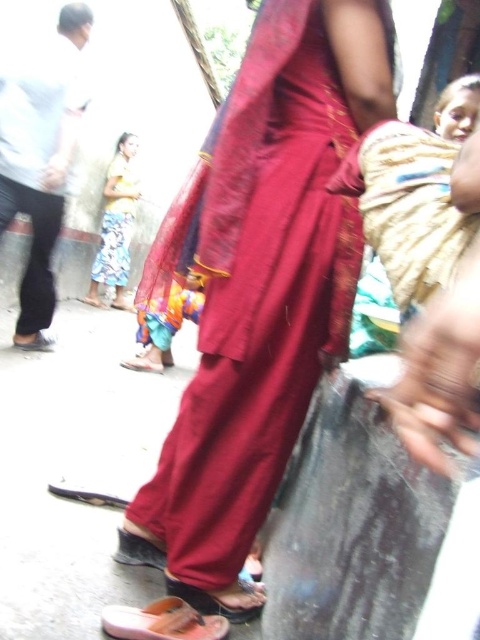
Is point (240, 140) farther from viewer compared to point (196, 588)?

That is False.

Between point (162, 253) and point (194, 588), which one is positioned behind?

The point (162, 253) is behind.

Is point (247, 58) positioned before point (219, 600)?

Yes, it is in front of point (219, 600).

You are a GUI agent. You are given a task and a screenshot of the screen. Output one action in this format:
    pyautogui.click(x=<x>, y=<y>)
    Task: Click on the matte red fabric at center
    The height and width of the screenshot is (640, 480).
    Given the screenshot: What is the action you would take?
    pyautogui.click(x=261, y=280)

This screenshot has height=640, width=480. What do you see at coordinates (162, 621) in the screenshot?
I see `orange rubber sandal at lower center` at bounding box center [162, 621].

Does orange rubber sandal at lower center have a lesser width compared to brown leather sandal at lower center?

No, orange rubber sandal at lower center is not thinner than brown leather sandal at lower center.

Image resolution: width=480 pixels, height=640 pixels. I want to click on orange rubber sandal at lower center, so click(162, 621).

Locate an element on the screen. This screenshot has height=640, width=480. matte red fabric at center is located at coordinates click(x=261, y=280).

Measure the distance between point (303,70) and camera.

Point (303,70) and camera are 38.01 inches apart.

Find the location of a particular element. The image size is (480, 640). matte red fabric at center is located at coordinates (261, 280).